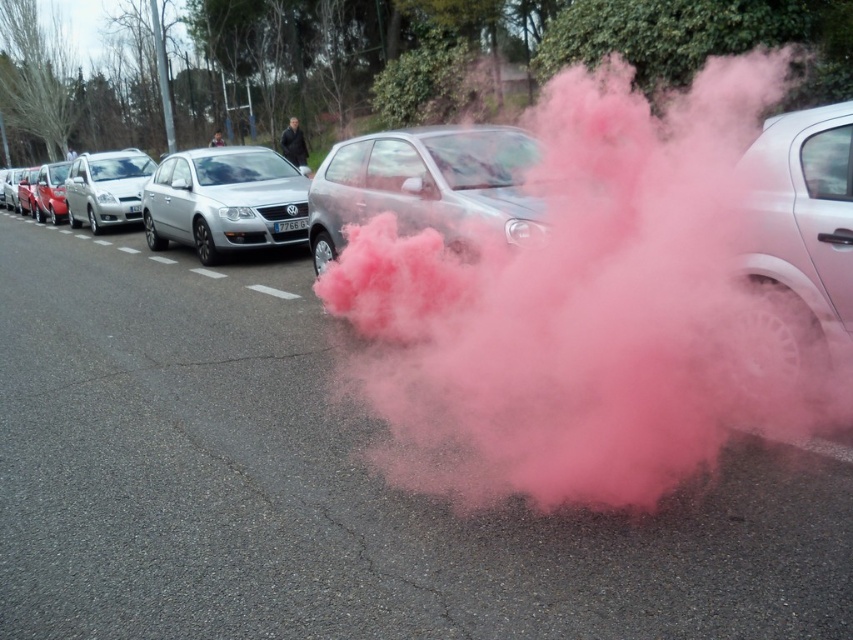
You are a pedestrian standing at the point marked by the coordinate point (328, 484). You see the pink smoke at center and the silver car parked on the right side of the road. Which direction should you move to get away from the pink smoke?

The pink smoke at center is located at the coordinate point (328, 484). Since you are standing at this point, you should move away from the silver car parked on the right side of the road to get away from the pink smoke.